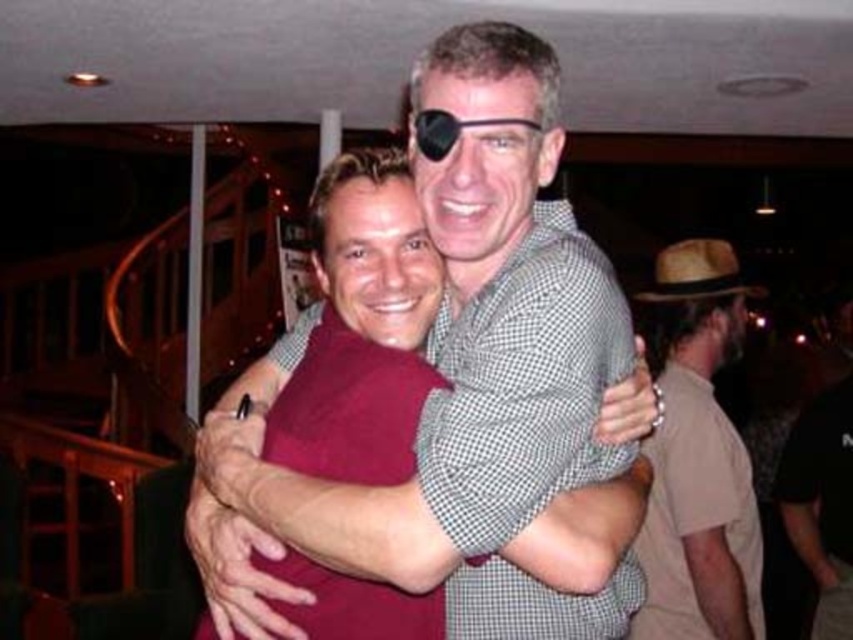
Is maroon shirt at center taller than brown straw cowboy hat at right?

Indeed, maroon shirt at center has a greater height compared to brown straw cowboy hat at right.

Is point (538, 620) less distant than point (698, 282)?

Yes, point (538, 620) is in front of point (698, 282).

This screenshot has height=640, width=853. Identify the location of maroon shirt at center. (460, 378).

Can you confirm if maroon shirt at center is smaller than brown straw hat at right?

Yes.

Locate an element on the screen. maroon shirt at center is located at coordinates (460, 378).

The image size is (853, 640). In order to click on maroon shirt at center in this screenshot , I will do `click(460, 378)`.

Does brown straw hat at right appear under brown straw cowboy hat at right?

Yes.

Is point (744, 620) positioned after point (717, 260)?

No, (744, 620) is closer to viewer.

Locate an element on the screen. The height and width of the screenshot is (640, 853). brown straw hat at right is located at coordinates [x=698, y=458].

Identify the location of brown straw hat at right. (698, 458).